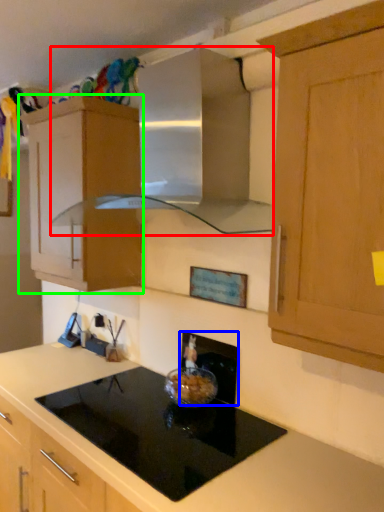
Question: Which object is positioned farthest from vent (highlighted by a red box)? Select from appliance (highlighted by a blue box) and cabinetry (highlighted by a green box).

Choices:
 (A) appliance
 (B) cabinetry

Answer: (A)